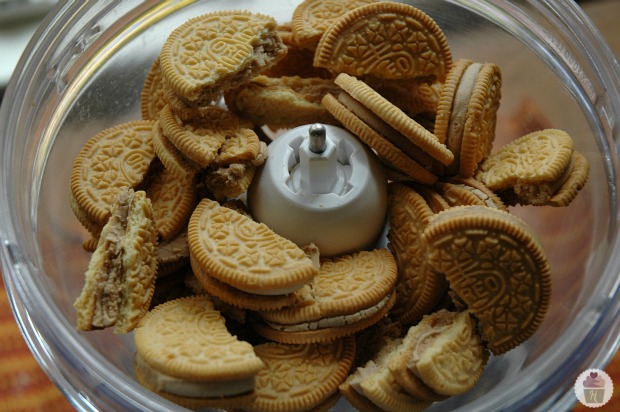
You are a GUI agent. You are given a task and a screenshot of the screen. Output one action in this format:
    pyautogui.click(x=<x>, y=<y>)
    Task: Click on the rim of glass bowl
    The width and height of the screenshot is (620, 412).
    Given the screenshot: What is the action you would take?
    tap(66, 338)